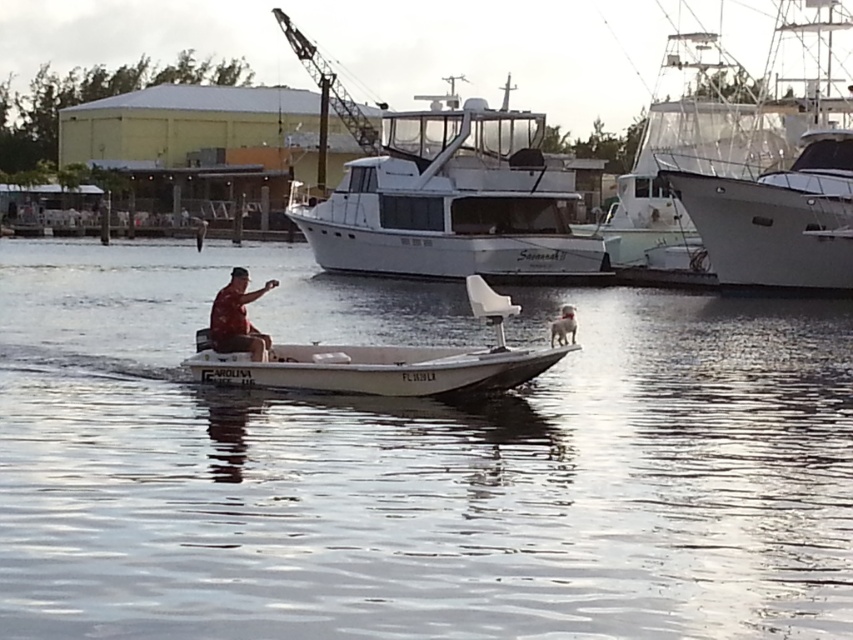
Question: Is clear water at center smaller than white fur dog at center?

Choices:
 (A) no
 (B) yes

Answer: (A)

Question: Estimate the real-world distances between objects in this image. Which object is closer to the white glossy boat at center?

Choices:
 (A) white glossy boat at upper right
 (B) metallic gray crane at upper center
 (C) camouflage fabric shirt at center
 (D) white matte boat at center

Answer: (A)

Question: Can you confirm if white glossy boat at upper right is positioned below camouflage fabric shirt at center?

Choices:
 (A) no
 (B) yes

Answer: (A)

Question: Considering the real-world distances, which object is farthest from the white fur dog at center?

Choices:
 (A) camouflage fabric shirt at center
 (B) white matte boat at center
 (C) white glossy boat at center
 (D) white glossy boat at upper right

Answer: (D)

Question: Is white glossy boat at upper right to the right of camouflage fabric shirt at center from the viewer's perspective?

Choices:
 (A) yes
 (B) no

Answer: (A)

Question: Estimate the real-world distances between objects in this image. Which object is closer to the white fur dog at center?

Choices:
 (A) white matte boat at center
 (B) metallic gray crane at upper center
 (C) camouflage fabric shirt at center

Answer: (C)